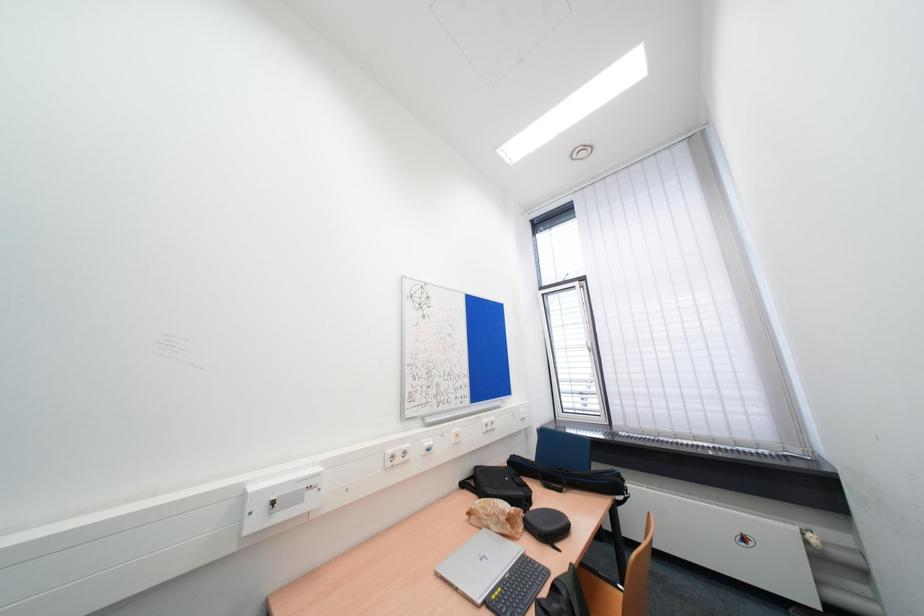
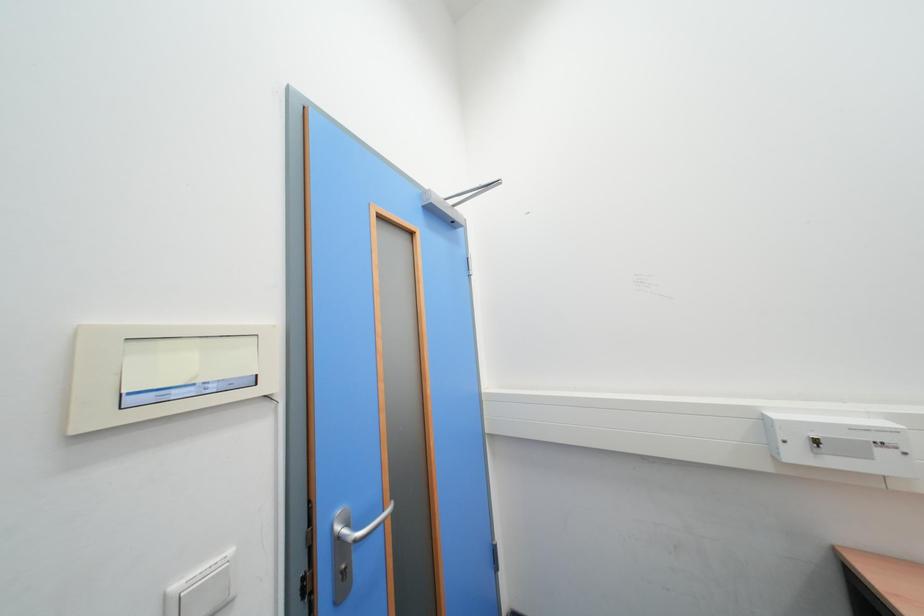
Question: The camera is either moving clockwise (left) or counter-clockwise (right) around the object. The first image is from the beginning of the video and the second image is from the end. Is the camera moving left or right when shooting the video?

Choices:
 (A) Left
 (B) Right

Answer: (B)